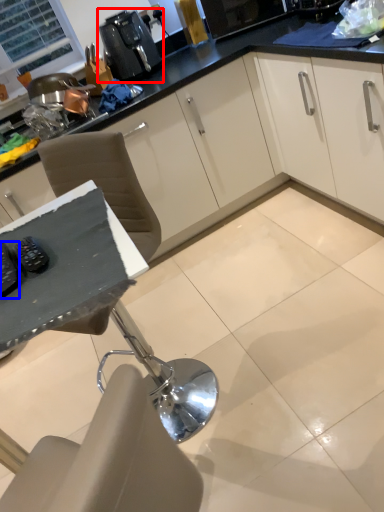
Question: Which object is further to the camera taking this photo, coffee machine (highlighted by a red box) or appliance (highlighted by a blue box)?

Choices:
 (A) coffee machine
 (B) appliance

Answer: (A)